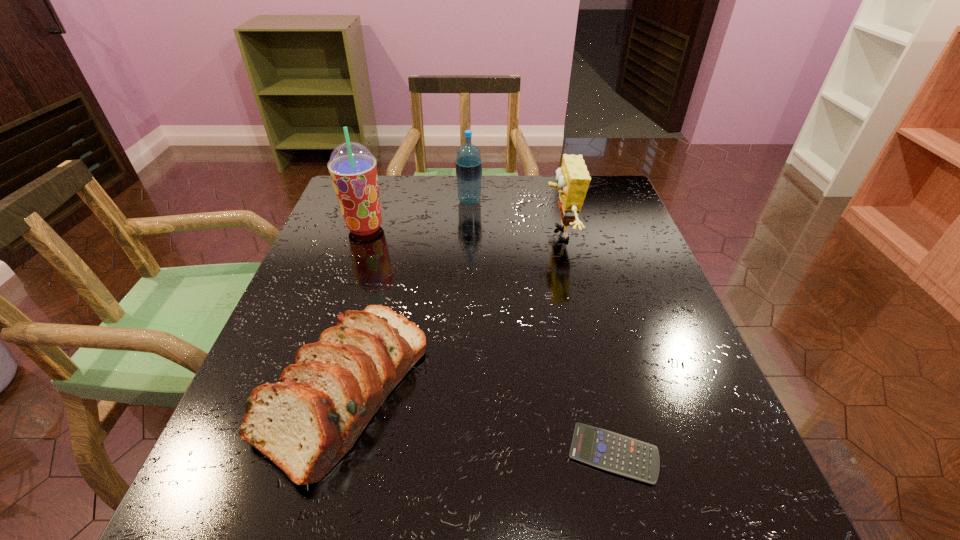
The width and height of the screenshot is (960, 540). I want to click on the tallest object, so click(353, 169).

Where is `water bottle`? water bottle is located at coordinates (468, 163).

Image resolution: width=960 pixels, height=540 pixels. I want to click on sponge, so (x=573, y=179).

The image size is (960, 540). I want to click on the fourth tallest object, so click(x=305, y=423).

I want to click on the shortest object, so [606, 450].

The height and width of the screenshot is (540, 960). What are the coordinates of `free spot located 0.090m on the back of the smoothie` in the screenshot? It's located at (375, 198).

Image resolution: width=960 pixels, height=540 pixels. In order to click on vacant space positioned on the right of the water bottle in this screenshot , I will do `click(537, 201)`.

Where is `vacant area situated on the face of the sponge`? vacant area situated on the face of the sponge is located at coordinates (391, 234).

Locate an element on the screen. vacant point located 0.380m on the face of the sponge is located at coordinates (391, 234).

Locate an element on the screen. Image resolution: width=960 pixels, height=540 pixels. free spot located 0.390m on the face of the sponge is located at coordinates (387, 234).